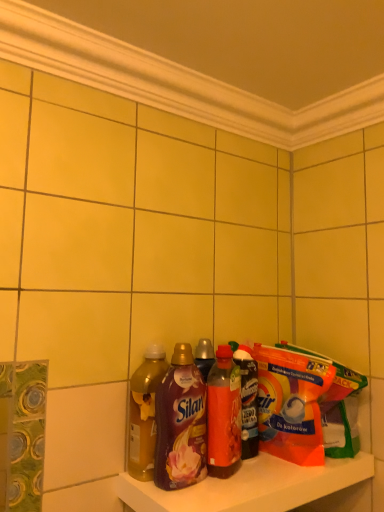
Identify the location of space that is in front of translucent plastic bottle at center, the second bottle viewed from the right. (229, 488).